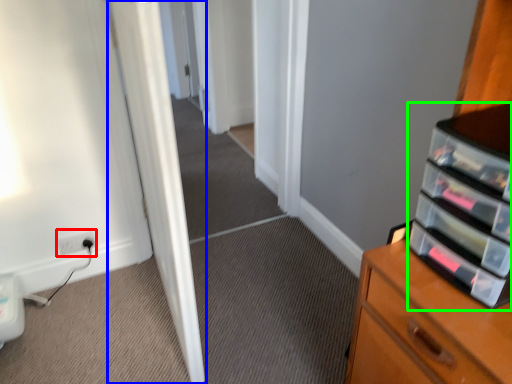
Question: Based on their relative distances, which object is farther from electric outlet (highlighted by a red box)? Choose from door (highlighted by a blue box) and shelf (highlighted by a green box).

Choices:
 (A) door
 (B) shelf

Answer: (B)